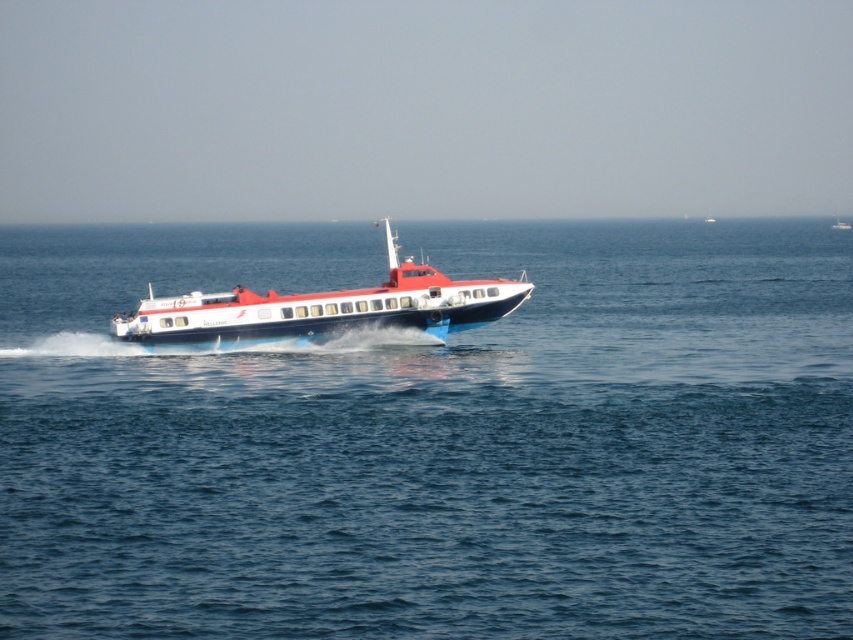
You are a passenger on the shiny blue and white boat at center and want to look at the blue water at center. In which direction should you look from your seat?

You should look to your right to see the blue water at center because the blue water at center is to the right of the shiny blue and white boat at center.

You are a passenger on the hydrofoil ferry and want to take a photo of both point [554,275] and point [303,314] from your current position. Which point will appear closer to the front of the photo?

Point [303,314] will appear closer to the front of the photo because it is closer to the viewer than point [554,275].

You are navigating a small boat and need to avoid the blue water at center. What direction should you steer to move away from it?

The blue water at center is located at point (434, 440), so steering away from that coordinate would help avoid it.